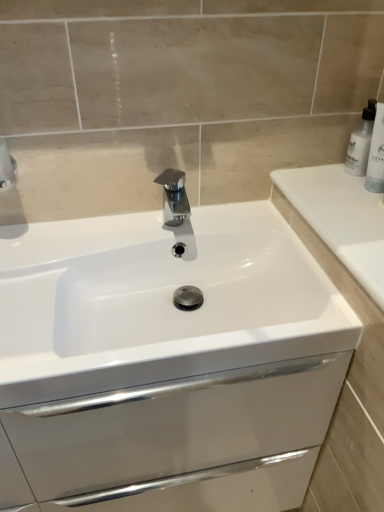
Question: Do you think white glossy bottle at upper right is within polished chrome tap at center, or outside of it?

Choices:
 (A) inside
 (B) outside

Answer: (B)

Question: In terms of size, does white glossy bottle at upper right appear bigger or smaller than polished chrome tap at center?

Choices:
 (A) small
 (B) big

Answer: (A)

Question: Which of these objects is positioned farthest from the white glossy sink at center?

Choices:
 (A) polished chrome tap at center
 (B) white plastic bottle at upper right
 (C) white glossy bottle at upper right

Answer: (B)

Question: Which object is the farthest from the white plastic bottle at upper right?

Choices:
 (A) white glossy sink at center
 (B) polished chrome tap at center
 (C) white glossy bottle at upper right

Answer: (A)